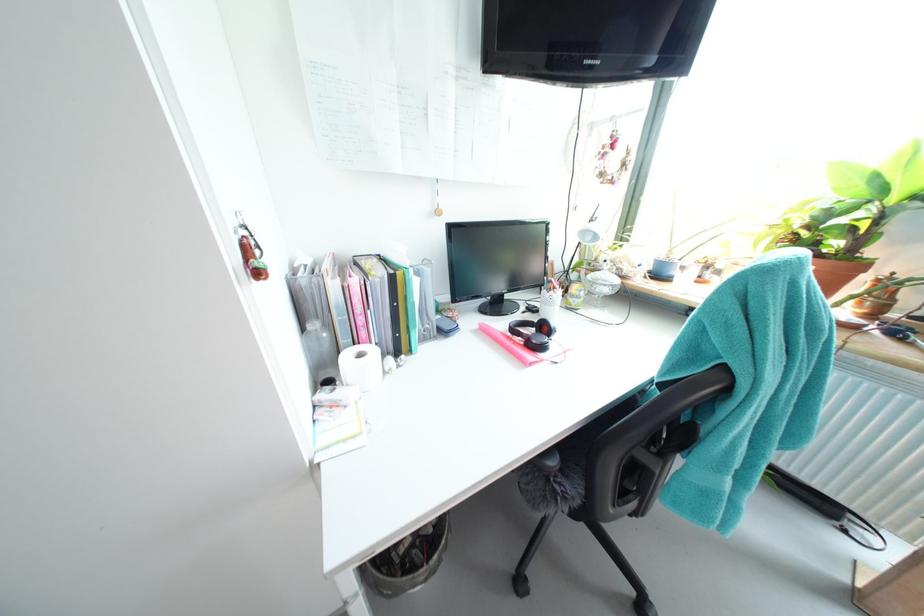
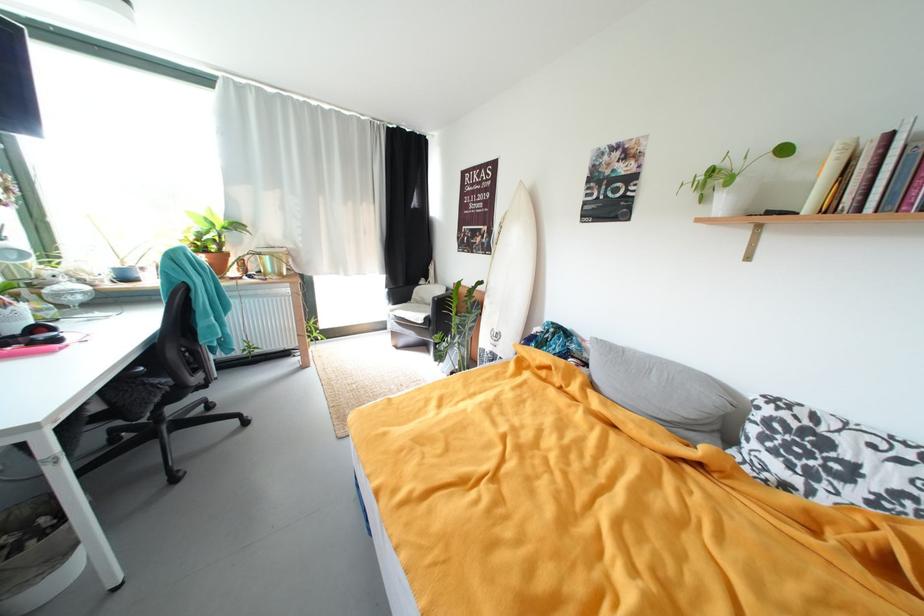
Locate, in the second image, the point that corresponds to (x=892, y=192) in the first image.

(221, 225)